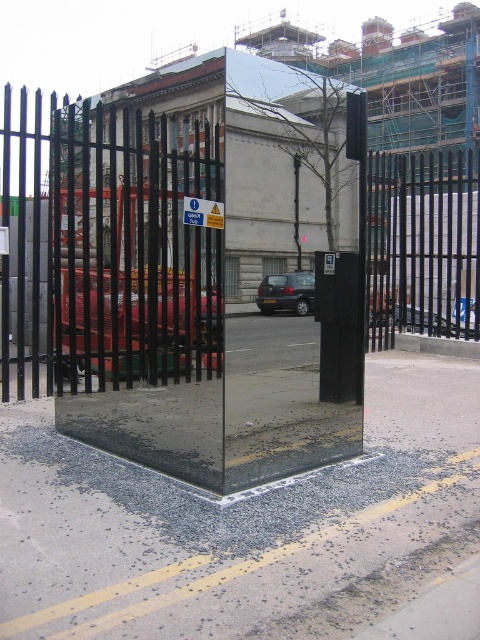
You are a delivery person trying to park your dark gray metallic car at center near the entrance. The entrance is marked by a metallic gate at center. Can you park your car directly in front of the gate without crossing the yellow painted line?

The metallic gate at center is above the dark gray metallic car at center, which means the gate is positioned higher than the car. Since the gate is above the car, there is enough vertical space to park the car directly in front of the gate without crossing the yellow line. However, ensure that the horizontal space between them allows for safe parking.

You are a delivery driver arriving at the construction site. You need to park your dark gray metallic car at center near the metallic gate at center. Given that the gate is larger than the car, can you estimate if there is enough space between the gate and the fence to park the car?

The metallic gate at center is larger in size than the dark gray metallic car at center, so there is sufficient space between the gate and the fence to park the car.